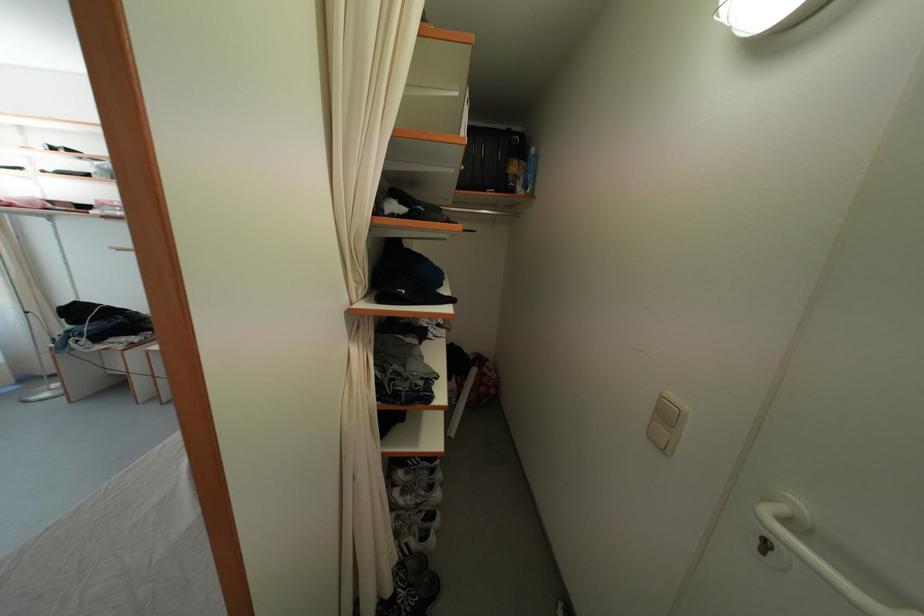
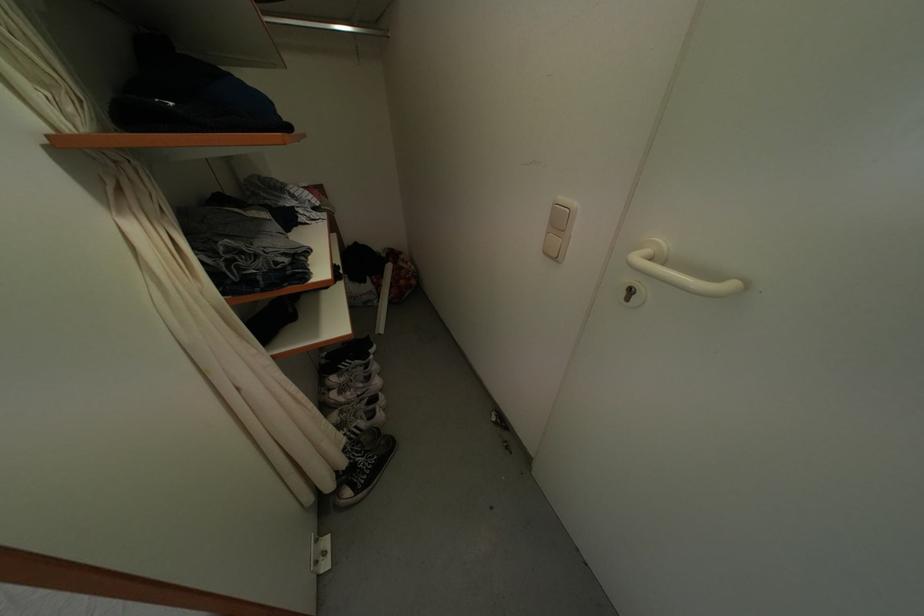
The point at (433, 477) is marked in the first image. Where is the corresponding point in the second image?

(369, 374)